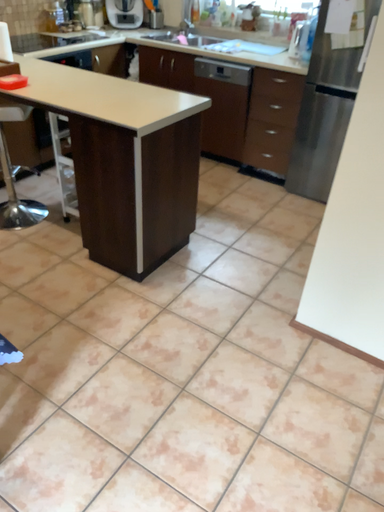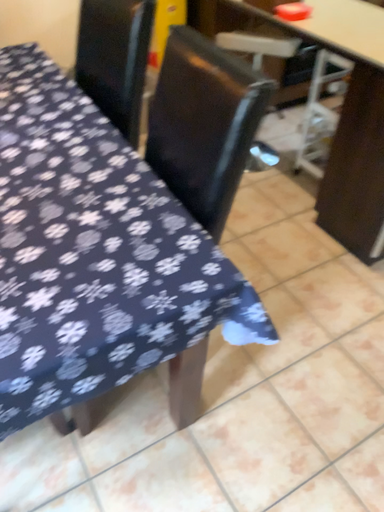
Question: Which way did the camera rotate in the video?

Choices:
 (A) rotated left
 (B) rotated right

Answer: (A)